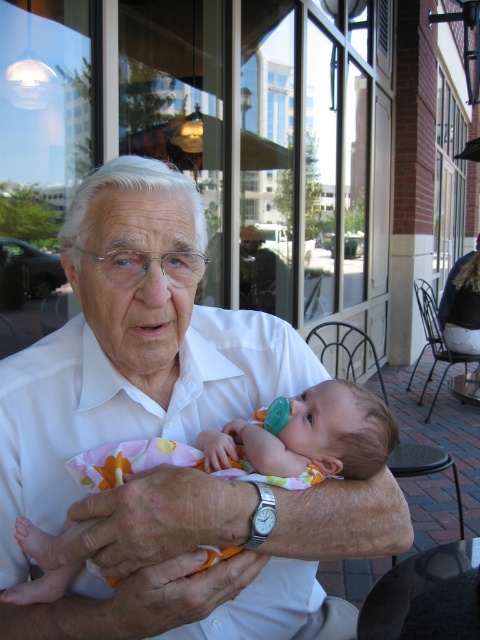
Question: Which point is closer to the camera?

Choices:
 (A) white smooth shirt at center
 (B) teal plastic pacifier at center

Answer: (A)

Question: Does white smooth shirt at center appear on the left side of teal plastic pacifier at center?

Choices:
 (A) yes
 (B) no

Answer: (A)

Question: Which object is closer to the camera taking this photo?

Choices:
 (A) white smooth shirt at center
 (B) teal plastic pacifier at center

Answer: (A)

Question: Is white smooth shirt at center above teal plastic pacifier at center?

Choices:
 (A) no
 (B) yes

Answer: (B)

Question: Does white smooth shirt at center appear over teal plastic pacifier at center?

Choices:
 (A) no
 (B) yes

Answer: (B)